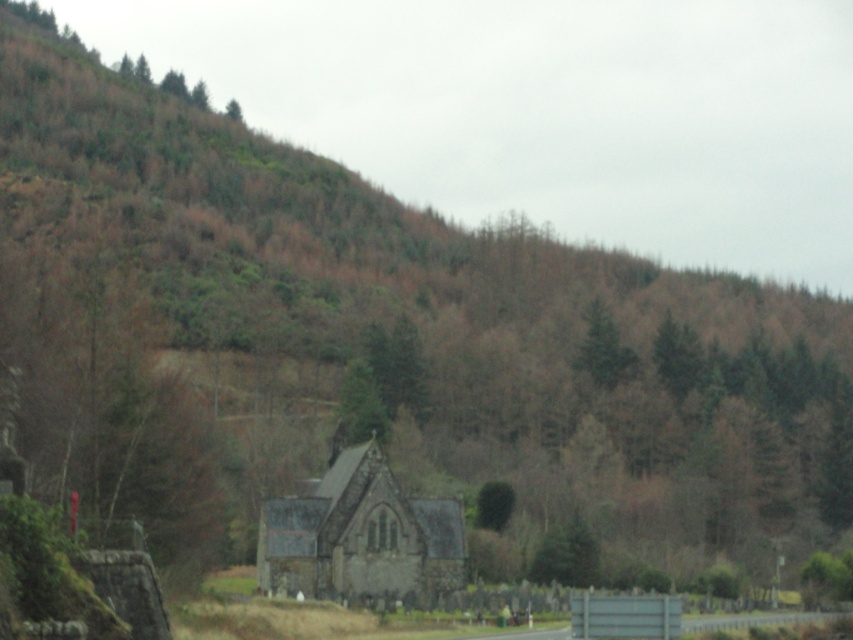
Question: Observing the image, what is the correct spatial positioning of stone church at center in reference to green textured tree at upper center?

Choices:
 (A) right
 (B) left

Answer: (B)

Question: Is stone church at center above green textured tree at upper center?

Choices:
 (A) no
 (B) yes

Answer: (A)

Question: Is stone church at center wider than green textured tree at upper center?

Choices:
 (A) yes
 (B) no

Answer: (A)

Question: Among these points, which one is farthest from the camera?

Choices:
 (A) (270, 513)
 (B) (624, 349)

Answer: (B)